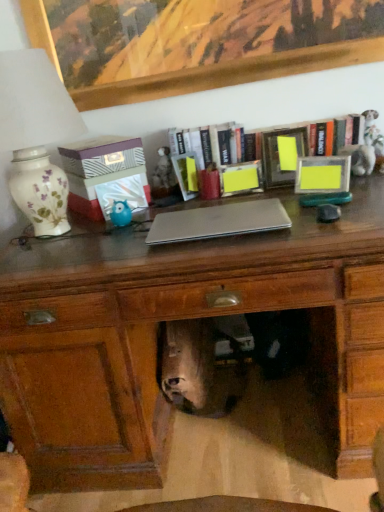
Locate an element on the screen. The image size is (384, 512). free space in front of silver metallic laptop at center is located at coordinates (226, 248).